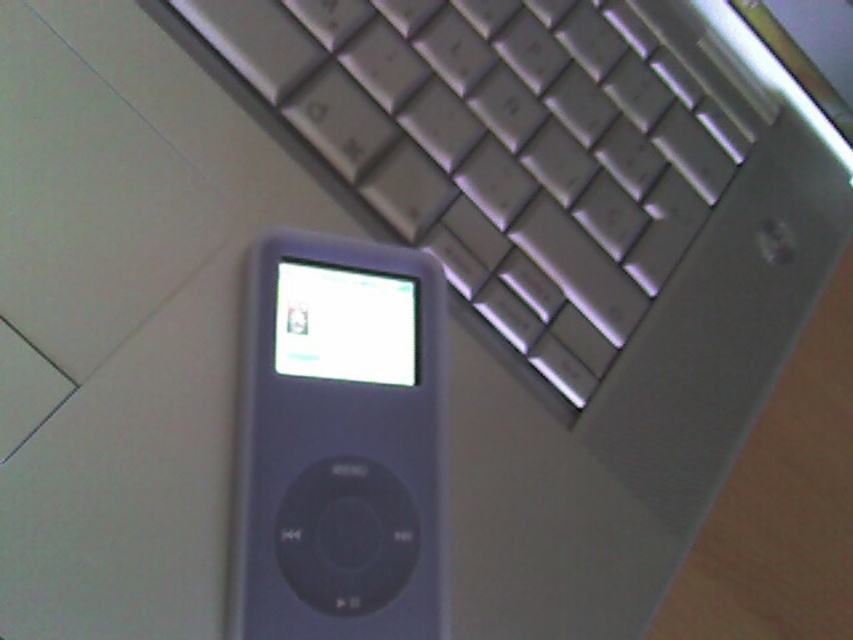
Question: Which point is closer to the camera?

Choices:
 (A) satin silver keyboard at center
 (B) slate gray plastic ipod at center

Answer: (B)

Question: Is satin silver keyboard at center above slate gray plastic ipod at center?

Choices:
 (A) yes
 (B) no

Answer: (A)

Question: Is satin silver keyboard at center below slate gray plastic ipod at center?

Choices:
 (A) no
 (B) yes

Answer: (A)

Question: Is satin silver keyboard at center thinner than slate gray plastic ipod at center?

Choices:
 (A) no
 (B) yes

Answer: (A)

Question: Which point is farther to the camera?

Choices:
 (A) (262, 600)
 (B) (579, 225)

Answer: (B)